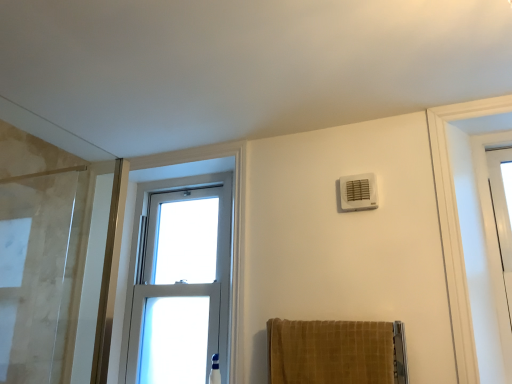
Find the location of `velvet gold towel at lower center`. velvet gold towel at lower center is located at coordinates [x=336, y=352].

The width and height of the screenshot is (512, 384). Find the location of `clear glass window at center`. clear glass window at center is located at coordinates (179, 281).

I want to click on white plastic air conditioning unit at upper right, so click(x=358, y=192).

The width and height of the screenshot is (512, 384). What do you see at coordinates (358, 192) in the screenshot? I see `white plastic air conditioning unit at upper right` at bounding box center [358, 192].

Where is `velvet gold towel at lower center`? velvet gold towel at lower center is located at coordinates (336, 352).

Is clear glass window at center thinner than white plastic air conditioning unit at upper right?

No, clear glass window at center is not thinner than white plastic air conditioning unit at upper right.

Is point (153, 254) closer or farther from the camera than point (345, 182)?

Point (153, 254) appears to be farther away from the viewer than point (345, 182).

From the image's perspective, which one is positioned higher, clear glass window at center or white plastic air conditioning unit at upper right?

white plastic air conditioning unit at upper right is shown above in the image.

Choose the correct answer: Is clear glass window at center inside white plastic air conditioning unit at upper right or outside it?

clear glass window at center is spatially situated outside white plastic air conditioning unit at upper right.

From a real-world perspective, which is physically above, velvet gold towel at lower center or white plastic air conditioning unit at upper right?

In real-world perspective, white plastic air conditioning unit at upper right is above.

How many degrees apart are the facing directions of velvet gold towel at lower center and white plastic air conditioning unit at upper right?

0.876 degrees separate the facing orientations of velvet gold towel at lower center and white plastic air conditioning unit at upper right.

Considering the points (271, 332) and (361, 200), which point is in front, point (271, 332) or point (361, 200)?

The point (271, 332) is in front.

Relative to white plastic air conditioning unit at upper right, is velvet gold towel at lower center in front or behind?

velvet gold towel at lower center is positioned closer to the viewer than white plastic air conditioning unit at upper right.

Considering the positions of points (305, 347) and (182, 378), is point (305, 347) closer to camera compared to point (182, 378)?

Yes, it is.

Is clear glass window at center a part of velvet gold towel at lower center?

No, clear glass window at center is not a part of velvet gold towel at lower center.

Is there a large distance between velvet gold towel at lower center and clear glass window at center?

That's not correct — velvet gold towel at lower center is a little close to clear glass window at center.

Considering the relative positions of clear glass window at center and velvet gold towel at lower center in the image provided, is clear glass window at center to the right of velvet gold towel at lower center from the viewer's perspective?

Result: In fact, clear glass window at center is to the left of velvet gold towel at lower center.

Considering the sizes of clear glass window at center and velvet gold towel at lower center in the image, is clear glass window at center taller or shorter than velvet gold towel at lower center?

Clearly, clear glass window at center is taller compared to velvet gold towel at lower center.

What are the coordinates of `window on the left of the velvet gold towel at lower center` in the screenshot? It's located at pos(179,281).

In order to click on air conditioning that appears on the right of velvet gold towel at lower center in this screenshot , I will do `click(358, 192)`.

Is white plastic air conditioning unit at upper right positioned in front of velvet gold towel at lower center?

No, white plastic air conditioning unit at upper right is further to the viewer.

From a real-world perspective, is white plastic air conditioning unit at upper right physically located above or below velvet gold towel at lower center?

Clearly, from a real-world perspective, white plastic air conditioning unit at upper right is above velvet gold towel at lower center.

How different are the orientations of white plastic air conditioning unit at upper right and clear glass window at center in degrees?

They differ by 1.25 degrees in their facing directions.

From the image's perspective, who appears lower, white plastic air conditioning unit at upper right or clear glass window at center?

clear glass window at center, from the image's perspective.

This screenshot has height=384, width=512. I want to click on window below the white plastic air conditioning unit at upper right (from a real-world perspective), so click(179, 281).

Is point (361, 209) in front of point (226, 182)?

That is True.

Where is `window on the left of white plastic air conditioning unit at upper right`? The width and height of the screenshot is (512, 384). window on the left of white plastic air conditioning unit at upper right is located at coordinates (179, 281).

Where is `air conditioning on the right of velvet gold towel at lower center`? The width and height of the screenshot is (512, 384). air conditioning on the right of velvet gold towel at lower center is located at coordinates coord(358,192).

Based on their spatial positions, is white plastic air conditioning unit at upper right or velvet gold towel at lower center further from clear glass window at center?

white plastic air conditioning unit at upper right is further to clear glass window at center.

From the image, which object appears to be nearer to velvet gold towel at lower center, white plastic air conditioning unit at upper right or clear glass window at center?

white plastic air conditioning unit at upper right is positioned closer to the anchor velvet gold towel at lower center.

Which object lies further to the anchor point white plastic air conditioning unit at upper right, clear glass window at center or velvet gold towel at lower center?

Based on the image, clear glass window at center appears to be further to white plastic air conditioning unit at upper right.

Considering their positions, is velvet gold towel at lower center positioned closer to white plastic air conditioning unit at upper right than clear glass window at center?

Among the two, velvet gold towel at lower center is located nearer to white plastic air conditioning unit at upper right.

Consider the image. When comparing their distances from velvet gold towel at lower center, does clear glass window at center or white plastic air conditioning unit at upper right seem further?

clear glass window at center lies further to velvet gold towel at lower center than the other object.

Which object lies nearer to the anchor point clear glass window at center, velvet gold towel at lower center or white plastic air conditioning unit at upper right?

velvet gold towel at lower center is closer to clear glass window at center.

Locate an element on the screen. towel between clear glass window at center and white plastic air conditioning unit at upper right is located at coordinates [x=336, y=352].